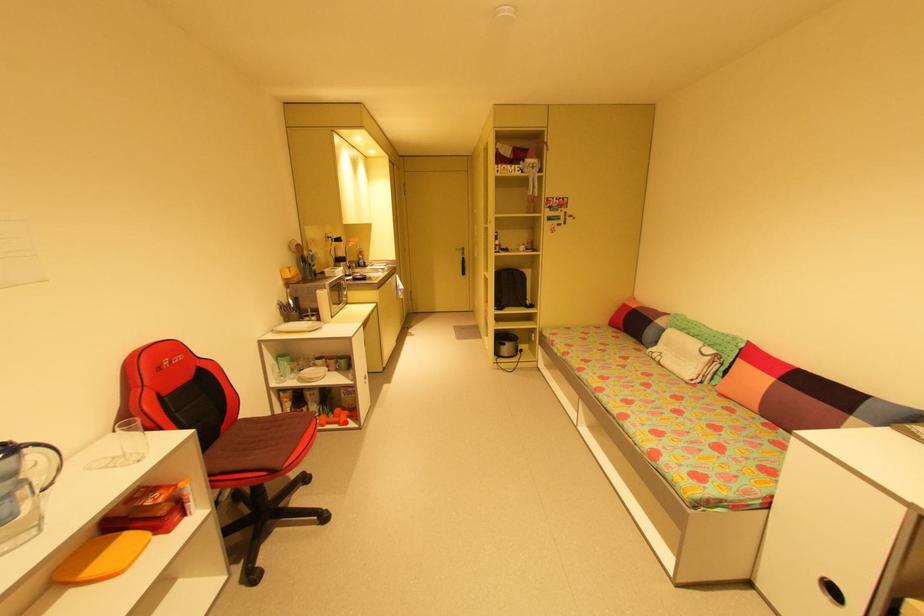
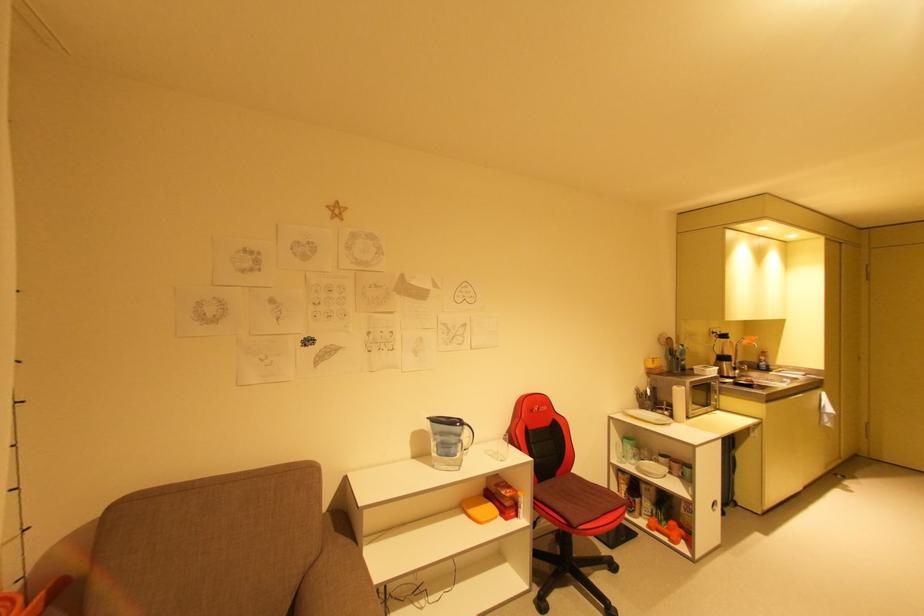
Question: I am providing you with two images of the same scene from different viewpoints. A red point is marked on the first image. Is the red point's position out of view in image 2?

Choices:
 (A) Yes
 (B) No

Answer: (B)